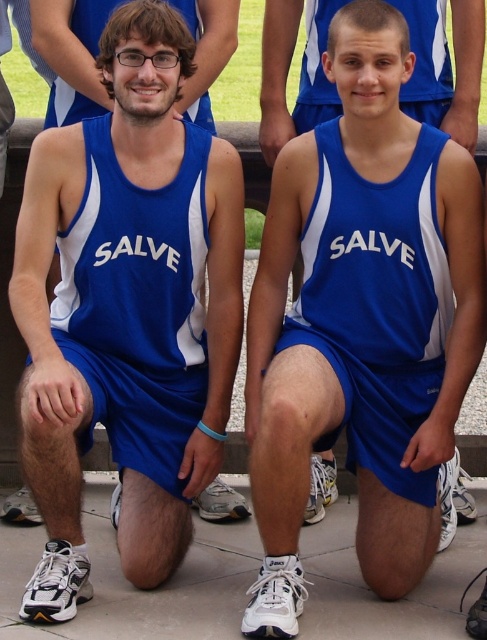
Is blue fabric shorts at lower left wider than matte blue singlet at upper center?

Indeed, blue fabric shorts at lower left has a greater width compared to matte blue singlet at upper center.

Who is positioned more to the left, blue fabric shorts at lower left or matte blue singlet at upper center?

matte blue singlet at upper center is more to the left.

Describe the element at coordinates (139, 296) in the screenshot. Image resolution: width=487 pixels, height=640 pixels. I see `blue fabric shorts at lower left` at that location.

This screenshot has height=640, width=487. I want to click on blue fabric shorts at lower left, so click(x=139, y=296).

Does point (406, 12) come behind point (85, 48)?

Yes, point (406, 12) is farther from viewer.

Is blue fabric shorts at center wider than matte blue singlet at upper center?

No.

Is point (331, 108) farther from camera compared to point (204, 93)?

That is False.

What are the coordinates of `blue fabric shorts at center` in the screenshot? It's located at (427, 60).

Based on the photo, who is lower down, blue fabric shorts at lower left or blue fabric shorts at center?

blue fabric shorts at lower left is lower down.

Which is behind, point (200, 138) or point (448, 77)?

The point (448, 77) is more distant.

You are a GUI agent. You are given a task and a screenshot of the screen. Output one action in this format:
    pyautogui.click(x=<x>, y=<y>)
    Task: Click on the blue fabric shorts at lower left
    Image resolution: width=487 pixels, height=640 pixels.
    Given the screenshot: What is the action you would take?
    pyautogui.click(x=139, y=296)